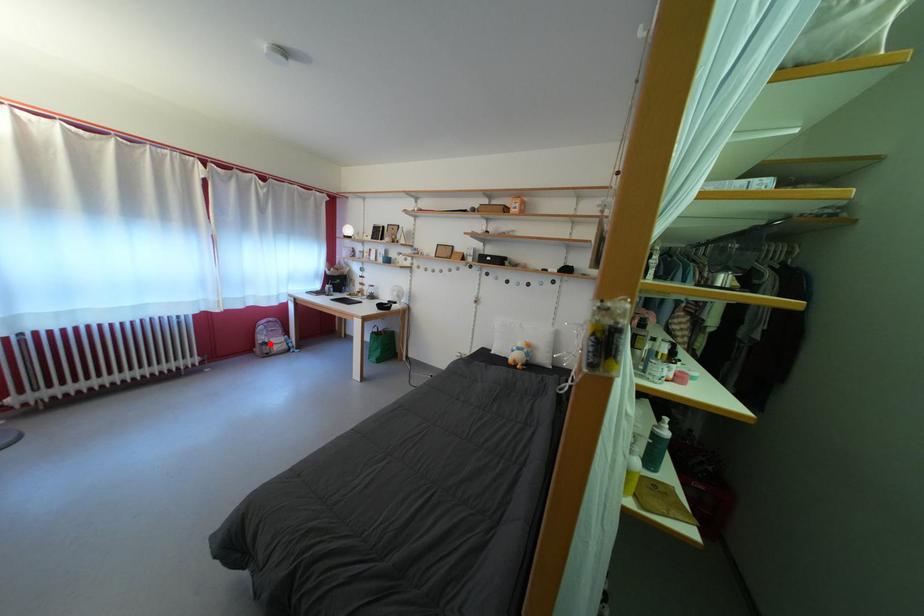
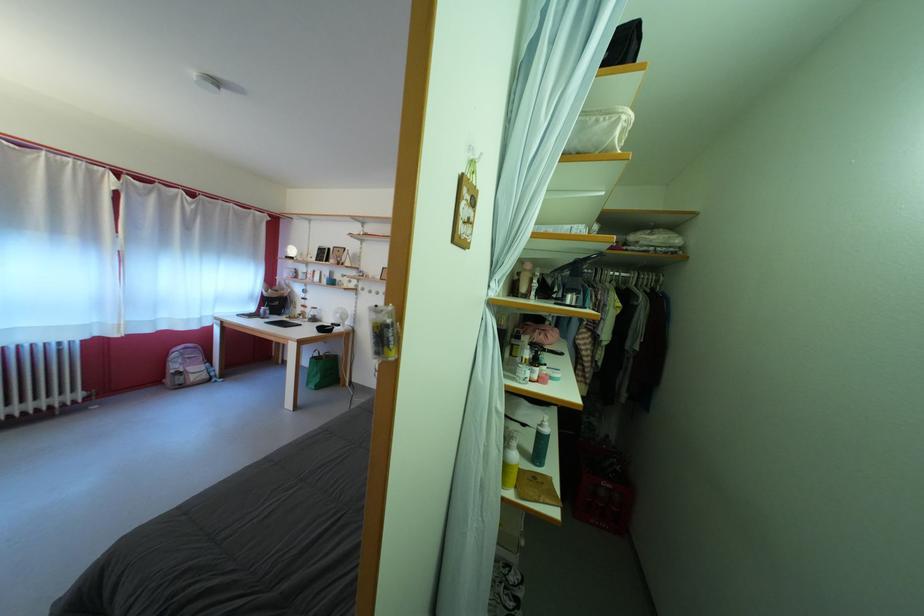
Question: I am providing you with two images of the same scene from different viewpoints. Given a red point in image1, look at the same physical point in image2. Is it:

Choices:
 (A) Closer to the viewpoint
 (B) Farther from the viewpoint

Answer: (A)